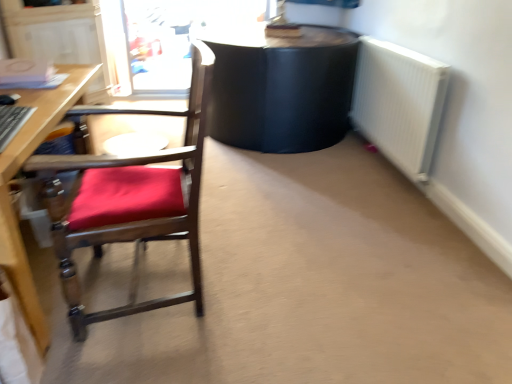
The image size is (512, 384). I want to click on empty space that is to the right of wooden chair with red cushion at left, so click(x=271, y=298).